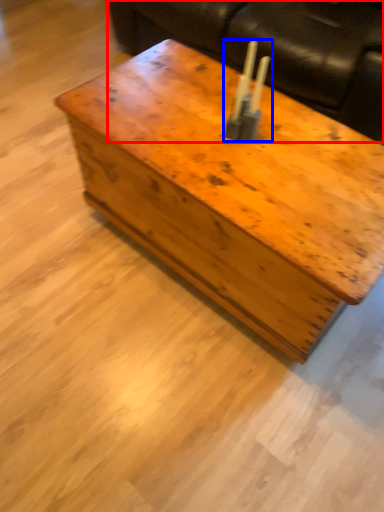
Question: Which object is closer to the camera taking this photo, couch (highlighted by a red box) or candle holder (highlighted by a blue box)?

Choices:
 (A) couch
 (B) candle holder

Answer: (B)